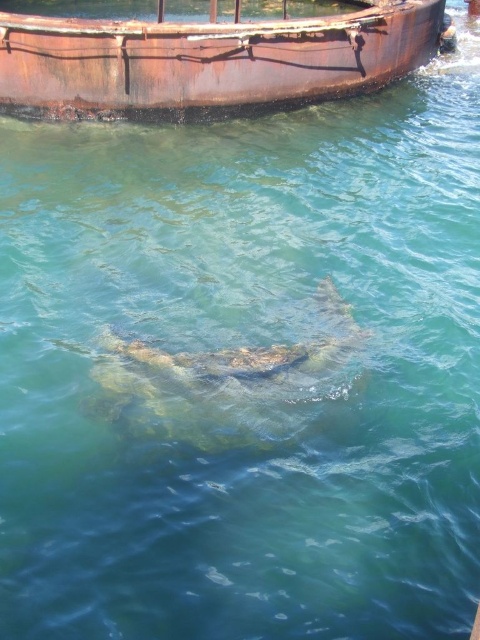
You are standing at the origin point in the image. You need to reach the point labeled as point (6, 52). However, there is an obstacle at point (104, 381). Can you go around the obstacle to reach your destination?

Yes, because point (6, 52) is behind point (104, 381), so you can navigate around the obstacle at point (104, 381) to reach your destination.